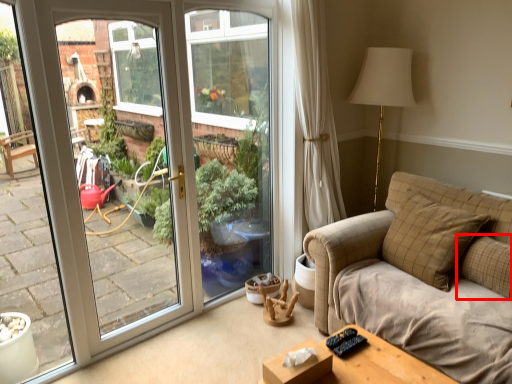
Question: From the image's perspective, where is pillow (annotated by the red box) located relative to pillow?

Choices:
 (A) above
 (B) below

Answer: (B)